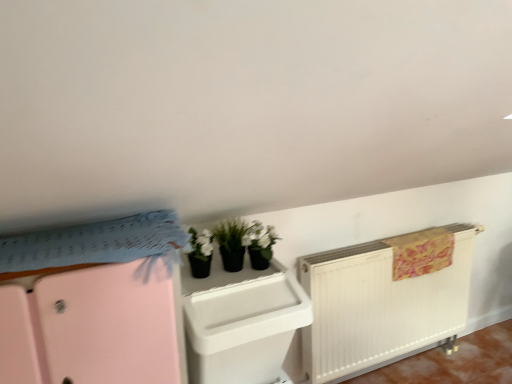
Question: From the image's perspective, is pink matte/file cabinet at upper left, the first file cabinet in the left-to-right sequence, positioned above or below white plastic file cabinet at center, acting as the first file cabinet starting from the right?

Choices:
 (A) above
 (B) below

Answer: (B)

Question: In the image, is pink matte/file cabinet at upper left, arranged as the second file cabinet when viewed from the right, on the left side or the right side of white plastic file cabinet at center, marked as the second file cabinet in a left-to-right arrangement?

Choices:
 (A) right
 (B) left

Answer: (B)

Question: In terms of height, does pink matte/file cabinet at upper left, arranged as the second file cabinet when viewed from the right, look taller or shorter compared to white plastic file cabinet at center, acting as the first file cabinet starting from the right?

Choices:
 (A) short
 (B) tall

Answer: (B)

Question: Does point (264, 347) appear closer or farther from the camera than point (94, 340)?

Choices:
 (A) closer
 (B) farther

Answer: (B)

Question: In the image, is white plastic file cabinet at center, acting as the first file cabinet starting from the right, on the left side or the right side of pink matte/file cabinet at upper left, arranged as the second file cabinet when viewed from the right?

Choices:
 (A) left
 (B) right

Answer: (B)

Question: Is white plastic file cabinet at center, acting as the first file cabinet starting from the right, spatially inside pink matte/file cabinet at upper left, the first file cabinet in the left-to-right sequence, or outside of it?

Choices:
 (A) inside
 (B) outside

Answer: (B)

Question: Is white plastic file cabinet at center, marked as the second file cabinet in a left-to-right arrangement, in front of or behind pink matte/file cabinet at upper left, the first file cabinet in the left-to-right sequence, in the image?

Choices:
 (A) front
 (B) behind

Answer: (B)